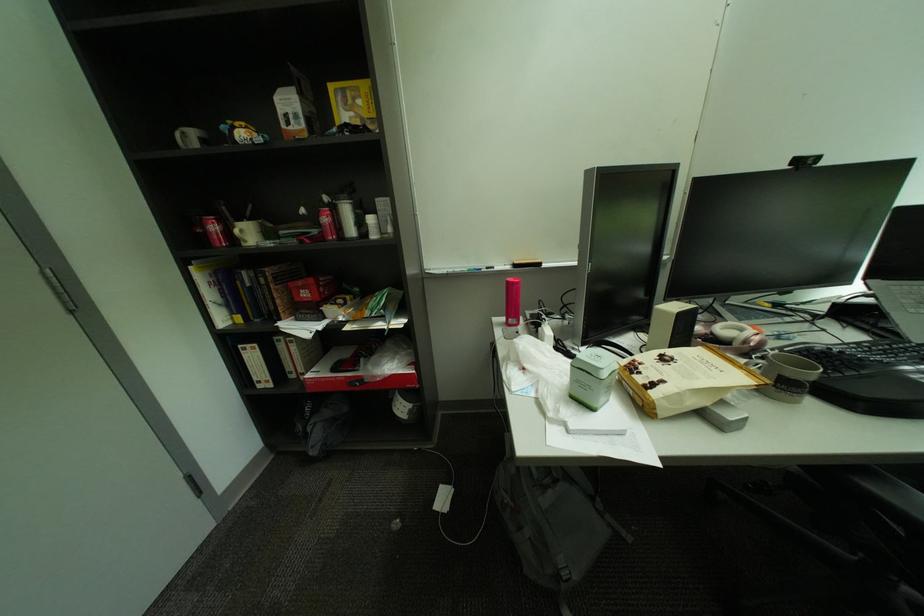
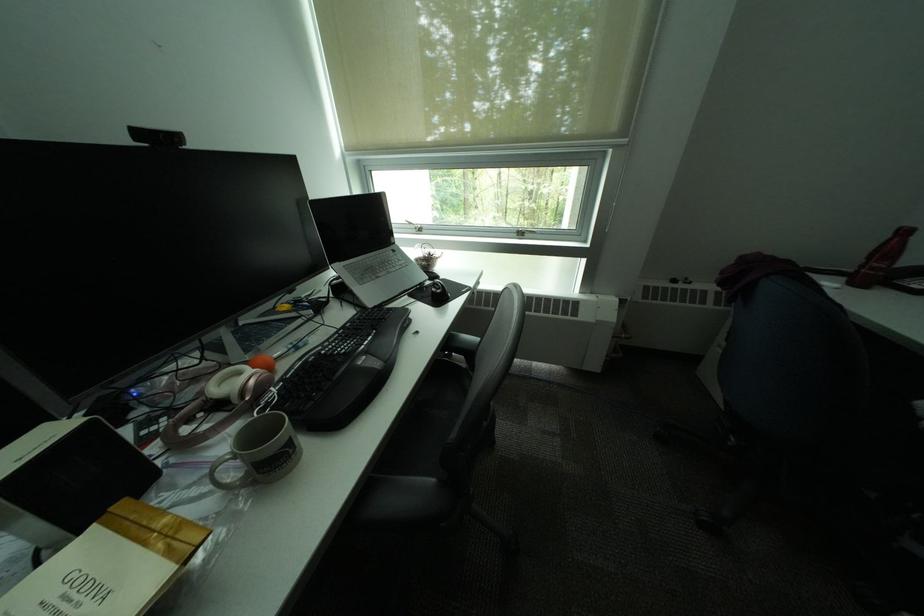
How did the camera likely rotate?

The rotation direction of the camera is right-down.